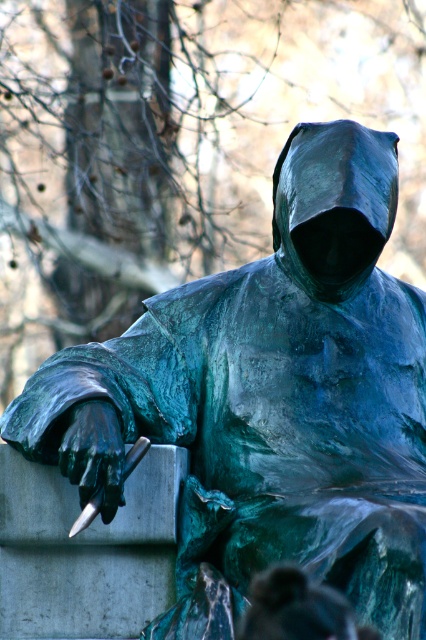
You are a photographer standing at the camera position. You want to take a closeup shot of the green patina hood at center. Considering the distance, is it possible to focus on the hood without moving closer?

The green patina hood at center is 142.78 feet away from camera, so focusing on it for a closeup shot without moving closer may be challenging due to the significant distance involved.

You are an art conservator examining the bronze statue. You notice the green patina hood at center and the green patina statue at center. Which object is positioned to the right side of the other?

The green patina hood at center is to the right of the green patina statue at center.

You are an art conservator examining the bronze statue. The green patina hood at center is positioned at coordinates 0.320 on the x and 0.784 on the y axis. If you need to clean the area around the hood, which part of the statue should you focus on relative to its position?

The green patina hood at center is located at point (333, 204). To clean the area around it, focus on the regions adjacent to these coordinates on the statue.